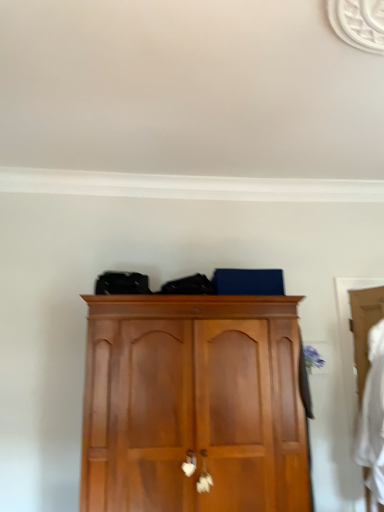
Question: In the image, is white fabric at right positioned in front of or behind wooden wardrobe at right?

Choices:
 (A) behind
 (B) front

Answer: (B)

Question: Is white fabric at right taller or shorter than wooden wardrobe at right?

Choices:
 (A) tall
 (B) short

Answer: (B)

Question: Based on their relative distances, which object is farther from the white fabric at right?

Choices:
 (A) wooden cupboard at center
 (B) wooden wardrobe at right

Answer: (A)

Question: Estimate the real-world distances between objects in this image. Which object is closer to the wooden cupboard at center?

Choices:
 (A) wooden wardrobe at right
 (B) white fabric at right

Answer: (A)